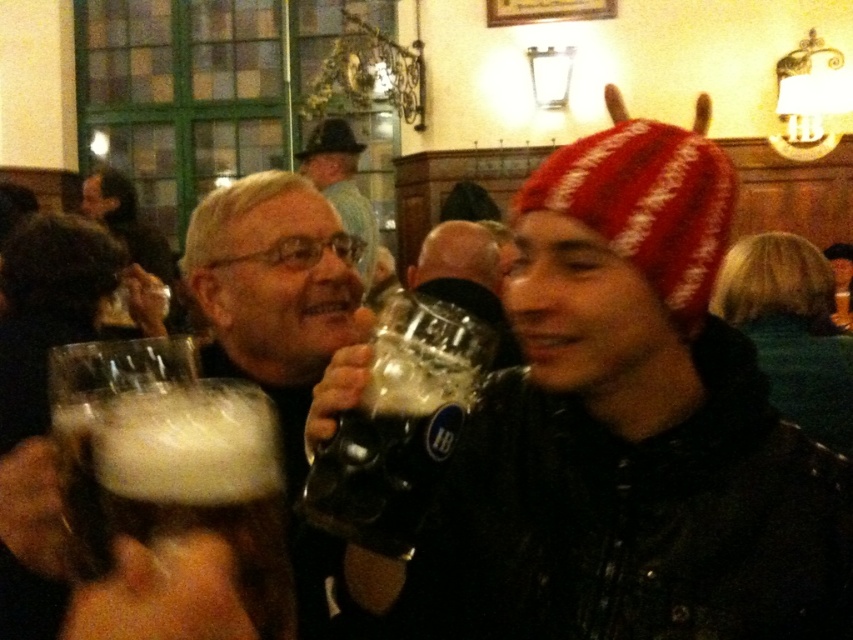
Does point (78, 365) come farther from viewer compared to point (310, 150)?

No.

Measure the distance from foamy brown glass at lower left to matte black beer mug at center.

5.75 meters

Who is more distant from viewer, (115, 387) or (352, 216)?

The point (352, 216) is behind.

The height and width of the screenshot is (640, 853). I want to click on foamy brown glass at lower left, so click(97, 419).

Is point (705, 161) behind point (358, 196)?

That is False.

Which is in front, point (546, 621) or point (347, 138)?

Point (546, 621) is more forward.

Identify the location of matte black mug at center. This screenshot has width=853, height=640. (624, 435).

Can you confirm if foamy brown glass at lower left is wider than brushed metal hat at upper center?

In fact, foamy brown glass at lower left might be narrower than brushed metal hat at upper center.

Between point (100, 506) and point (325, 120), which one is positioned in front?

Point (100, 506) is in front.

Between point (73, 417) and point (341, 125), which one is positioned behind?

The point (341, 125) is more distant.

The image size is (853, 640). Find the location of `foamy brown glass at lower left`. foamy brown glass at lower left is located at coordinates (97, 419).